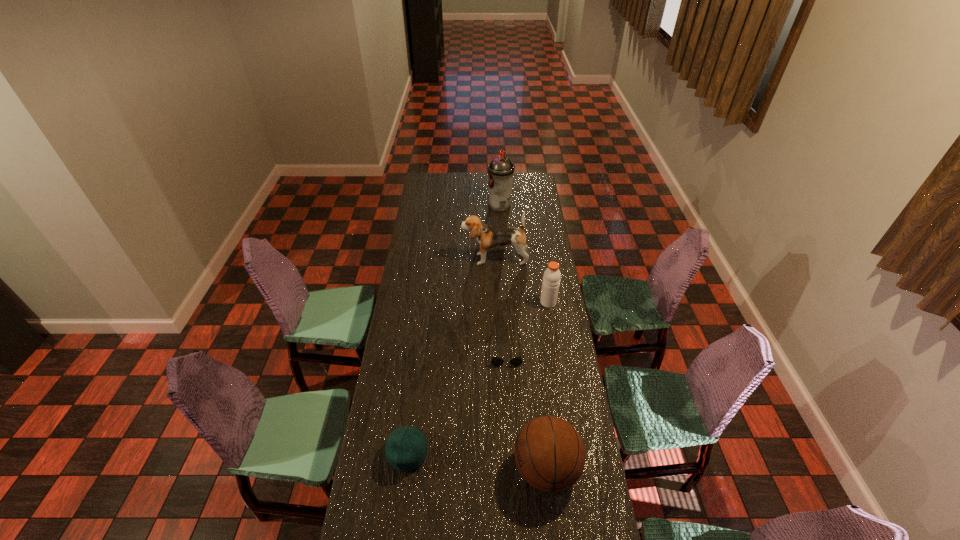
Find the location of `vacant position in the image that satisfies the following two spatial constraints: 1. on the back side of the shaker; 2. on the left side of the fifth tallest object`. vacant position in the image that satisfies the following two spatial constraints: 1. on the back side of the shaker; 2. on the left side of the fifth tallest object is located at coordinates (426, 302).

Where is `vacant space that satisfies the following two spatial constraints: 1. on the front side of the fourth nearest object; 2. on the side with brand label of the basketball`? The height and width of the screenshot is (540, 960). vacant space that satisfies the following two spatial constraints: 1. on the front side of the fourth nearest object; 2. on the side with brand label of the basketball is located at coordinates (574, 469).